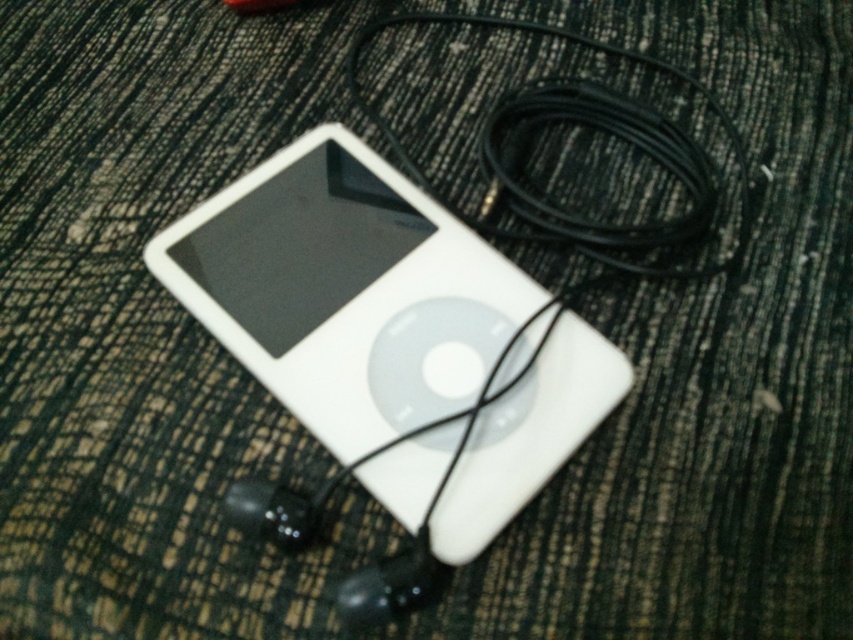
In the scene shown: You are examining the iPod and its accessories in the image. There are two points marked in the scene. Which point is closer to you, point (442, 209) or point (543, 205)?

Point (442, 209) is closer to you than point (543, 205) because it is further to the viewer.

You are setting up a small display and need to arrange the white matte ipod at center and the black cable at upper right. If you want to place them side by side horizontally, which one should be placed first to ensure they fit properly?

The white matte ipod at center is much taller than the black cable at upper right, so you should place the white matte ipod at center first to accommodate its height when arranging them side by side horizontally.

You are organizing a small electronics display and need to place the white matte ipod at center and the black cable at upper right. Given that the display area has limited space, which object should you prioritize placing first to ensure both fit properly?

The white matte ipod at center should be placed first because it has a larger size compared to the black cable at upper right, ensuring there is enough space for both items in the display area.